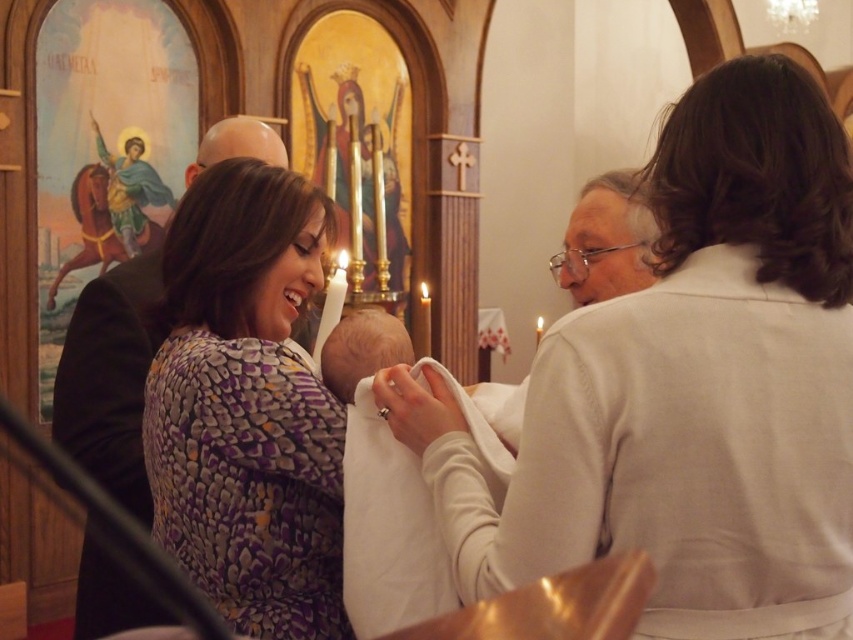
You are standing in the church and see the purple printed dress at center and the dark brown leather jacket at left. Which object is positioned lower in the scene?

The purple printed dress at center is positioned lower than the dark brown leather jacket at left.